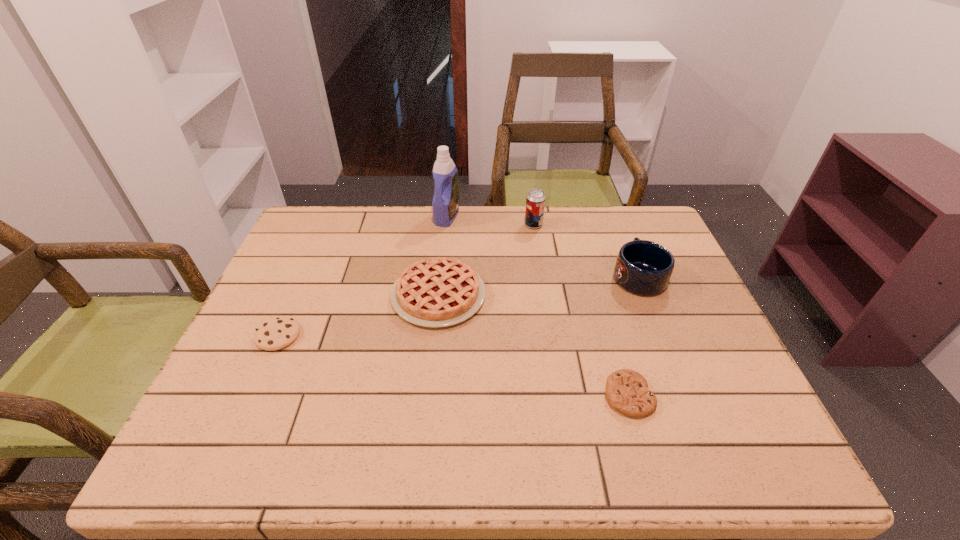
I want to click on object positioned at the right edge, so click(643, 267).

Where is `vacant space at the far edge`? This screenshot has width=960, height=540. vacant space at the far edge is located at coordinates (603, 227).

The height and width of the screenshot is (540, 960). What are the coordinates of `free space at the near edge of the desktop` in the screenshot? It's located at (415, 444).

Identify the location of free space at the left edge of the desktop. (285, 381).

In the image, there is a desktop. Where is `vacant space at the right edge`? The image size is (960, 540). vacant space at the right edge is located at coordinates (710, 347).

This screenshot has height=540, width=960. In the image, there is a desktop. What are the coordinates of `free space at the far left corner` in the screenshot? It's located at (315, 222).

Identify the location of free space at the far right corner of the desktop. Image resolution: width=960 pixels, height=540 pixels. (614, 213).

This screenshot has width=960, height=540. I want to click on empty space that is in between the detergent and the mug, so [542, 246].

This screenshot has height=540, width=960. Identify the location of free space between the shorter cookie and the mug. (634, 336).

I want to click on free area in between the pie and the mug, so click(x=539, y=286).